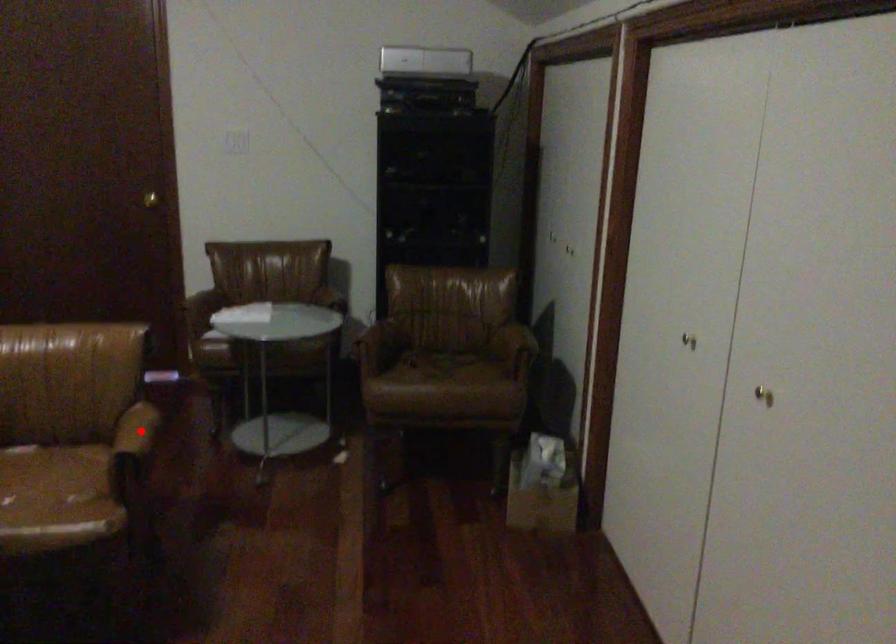
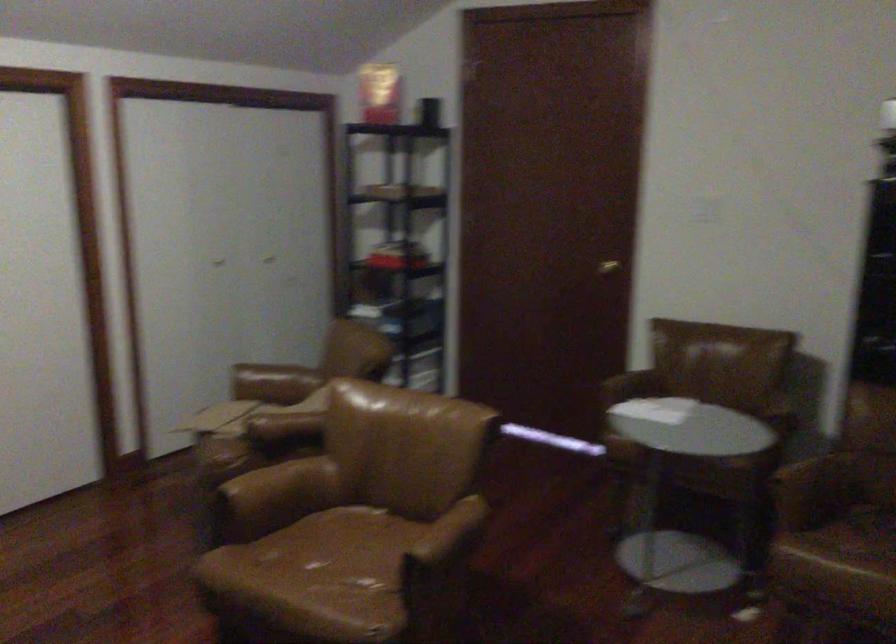
Question: A red point is marked in image1. In image2, is the corresponding 3D point closer to the camera or farther? Reply with the corresponding letter.

Choices:
 (A) The corresponding 3D point is closer.
 (B) The corresponding 3D point is farther.

Answer: (A)